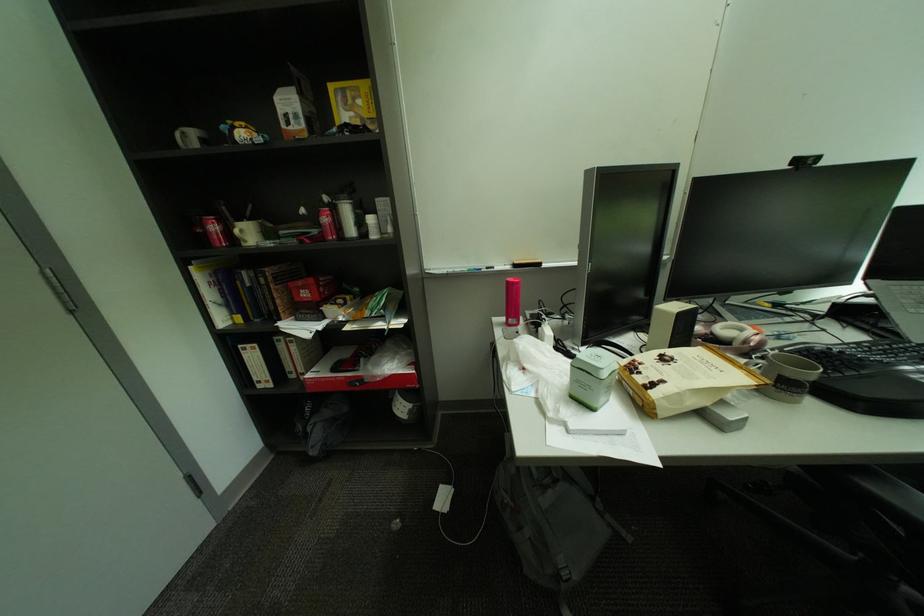
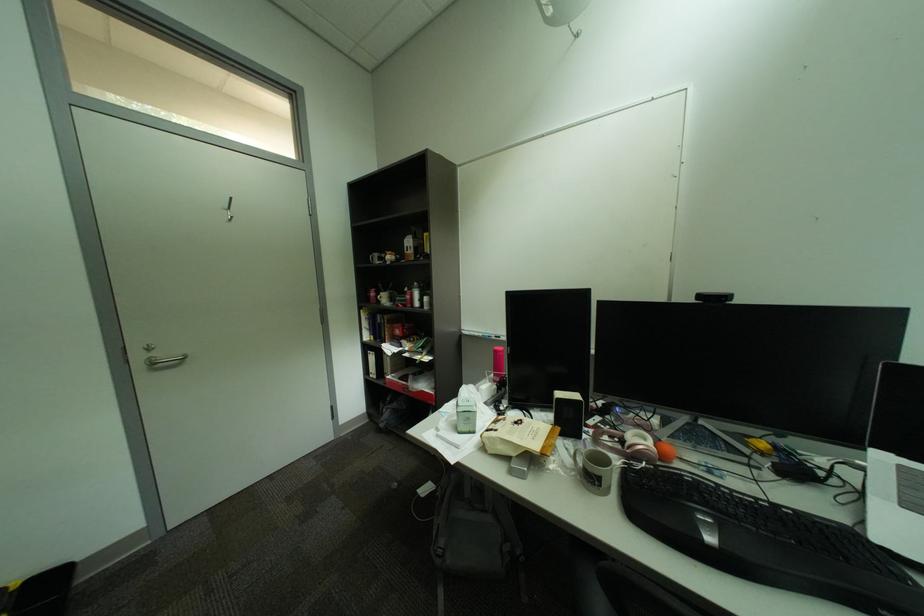
Question: The camera is either moving clockwise (left) or counter-clockwise (right) around the object. The first image is from the beginning of the video and the second image is from the end. Is the camera moving left or right when shooting the video?

Choices:
 (A) Left
 (B) Right

Answer: (B)